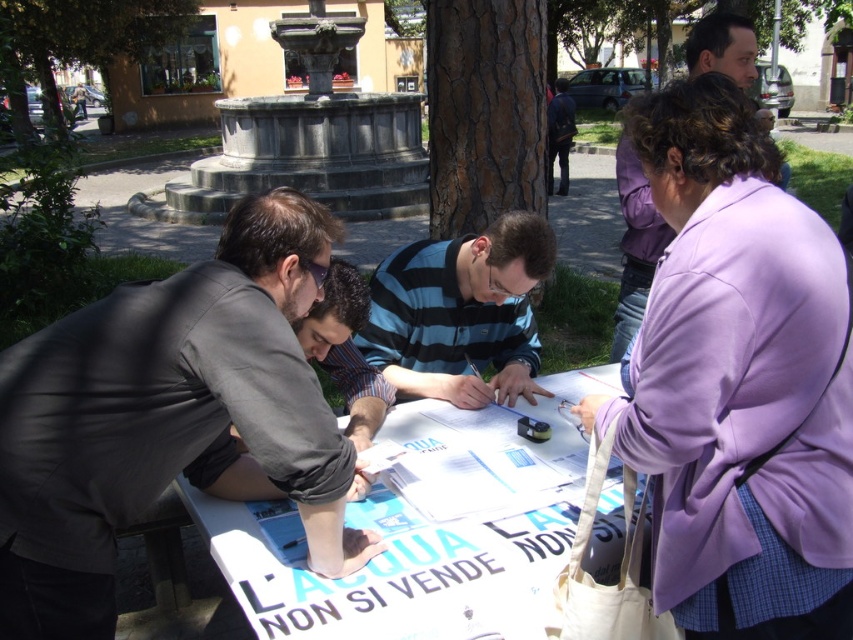
Question: Can you confirm if dark gray suit at left is smaller than purple fabric jacket at upper right?

Choices:
 (A) yes
 (B) no

Answer: (A)

Question: Is purple fabric coat at upper right behind dark blue striped shirt at center?

Choices:
 (A) yes
 (B) no

Answer: (B)

Question: Estimate the real-world distances between objects in this image. Which object is farther from the dark blue striped shirt at center?

Choices:
 (A) dark gray suit at left
 (B) blue striped shirt at center

Answer: (A)

Question: Can you confirm if purple fabric coat at upper right is positioned below dark gray suit at left?

Choices:
 (A) yes
 (B) no

Answer: (B)

Question: Which of the following is the closest to the observer?

Choices:
 (A) purple fabric coat at upper right
 (B) dark gray suit at left
 (C) blue striped shirt at center

Answer: (A)

Question: Estimate the real-world distances between objects in this image. Which object is closer to the blue striped shirt at center?

Choices:
 (A) purple fabric jacket at upper right
 (B) purple fabric coat at upper right

Answer: (B)